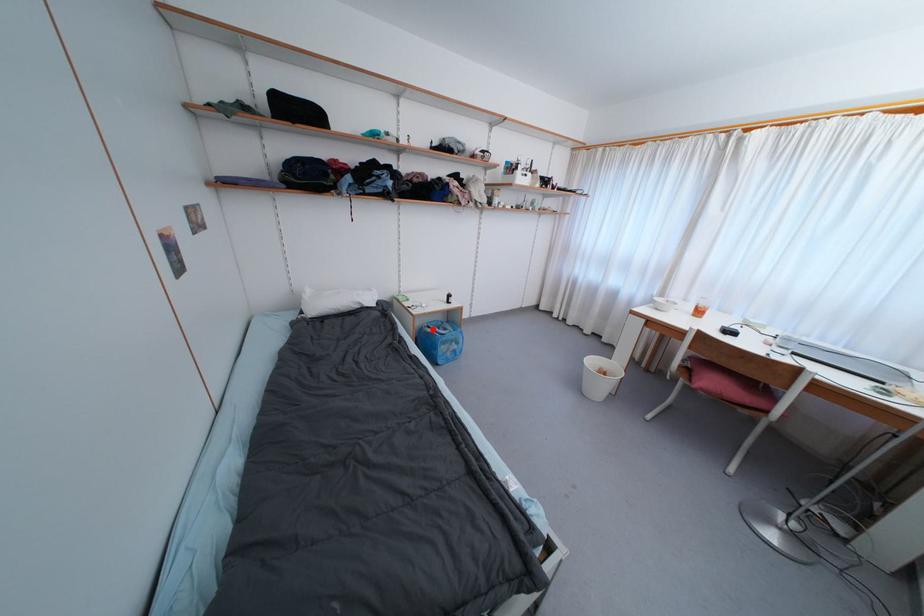
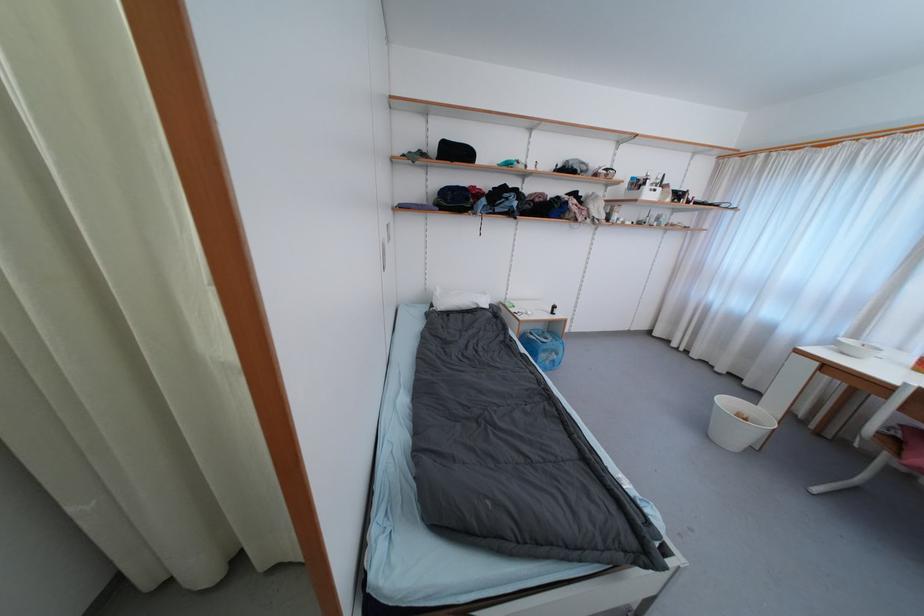
Question: I am providing you with two images of the same scene from different viewpoints. In image1, a red point is highlighted. Considering the same 3D point in image2, which of the following is correct?

Choices:
 (A) It is closer
 (B) It is farther

Answer: (B)